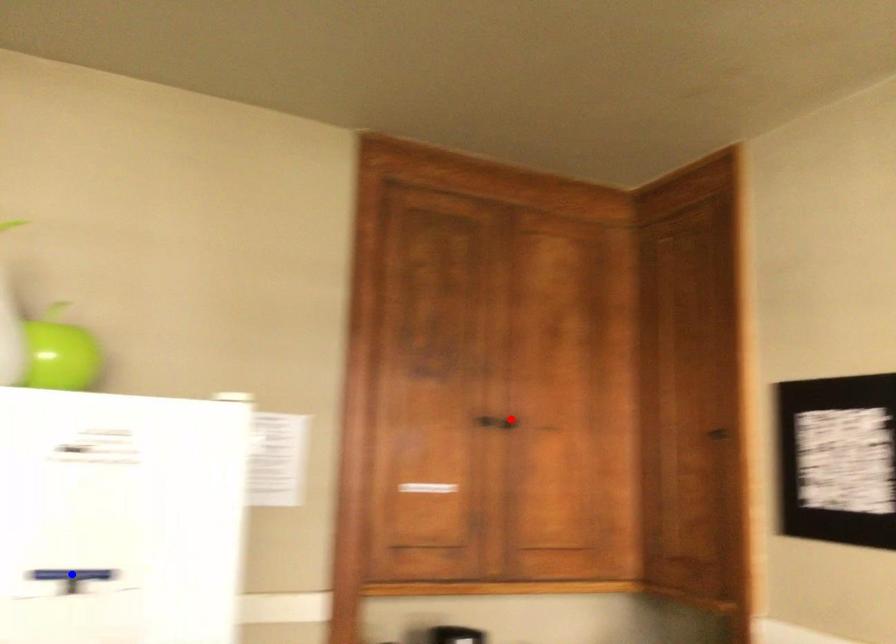
Question: In the image, two points are highlighted. Which point is nearer to the camera? Reply with the corresponding letter.

Choices:
 (A) blue point
 (B) red point

Answer: (A)